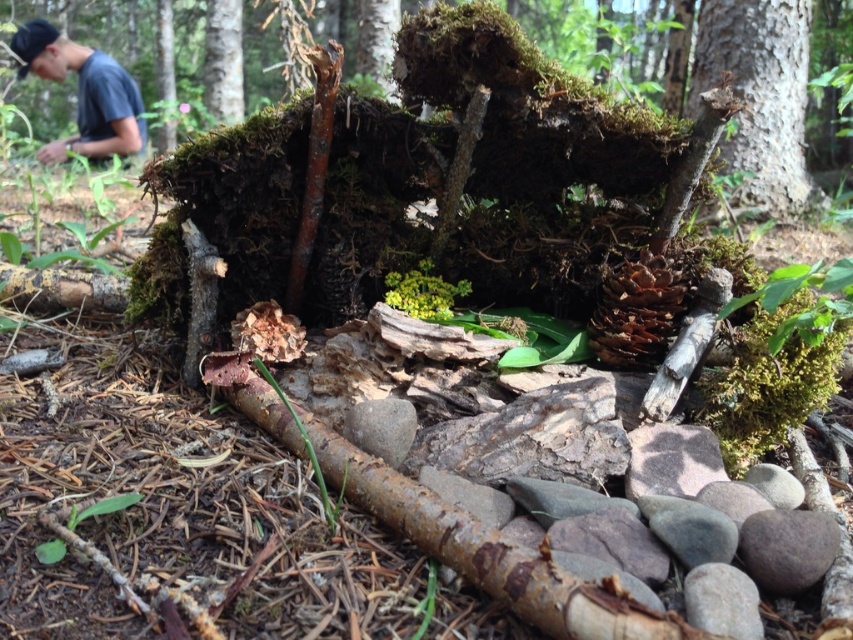
Does green mossy bark at upper right have a lesser width compared to blue cotton shirt at upper left?

Yes.

Does green mossy bark at upper right appear on the left side of blue cotton shirt at upper left?

Incorrect, green mossy bark at upper right is not on the left side of blue cotton shirt at upper left.

Where is `green mossy bark at upper right`? green mossy bark at upper right is located at coordinates (759, 96).

Can you confirm if brown rough pine cone at center-right is positioned above white smooth tree trunk at upper left?

Actually, brown rough pine cone at center-right is below white smooth tree trunk at upper left.

Is point (637, 262) less distant than point (222, 42)?

Yes, it is in front of point (222, 42).

Does point (633, 362) lie in front of point (233, 102)?

Yes, point (633, 362) is in front of point (233, 102).

This screenshot has width=853, height=640. In order to click on brown rough pine cone at center-right in this screenshot , I will do `click(637, 310)`.

Can you confirm if green mossy bark at upper right is positioned below white smooth tree trunk at upper left?

Yes, green mossy bark at upper right is below white smooth tree trunk at upper left.

Who is more distant from viewer, (770, 33) or (236, 60)?

Positioned behind is point (236, 60).

In order to click on green mossy bark at upper right in this screenshot , I will do `click(759, 96)`.